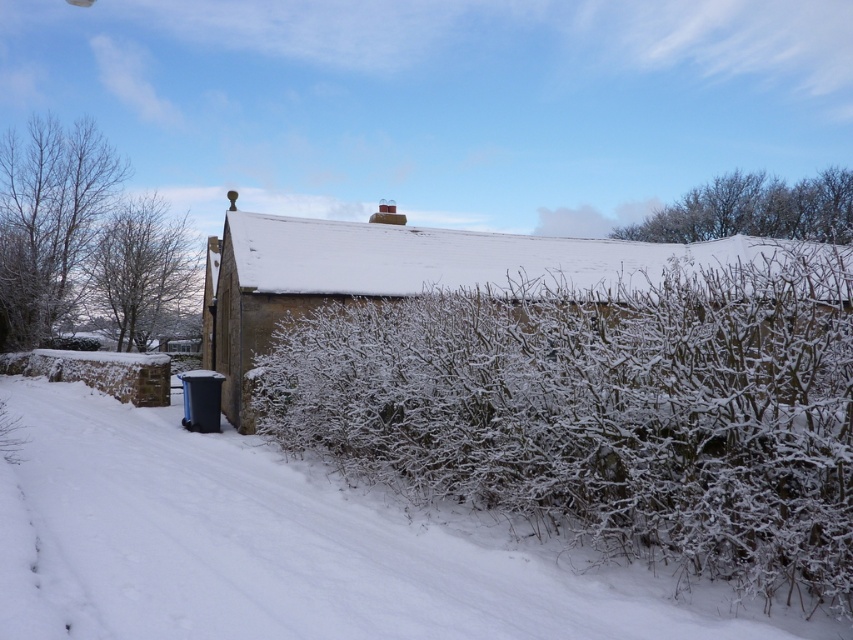
Question: Does white frosted hedge at center have a larger size compared to white frosty hedge at center?

Choices:
 (A) no
 (B) yes

Answer: (B)

Question: Is white frosted hedge at center thinner than white frosty hedge at center?

Choices:
 (A) no
 (B) yes

Answer: (A)

Question: Which point is closer to the camera taking this photo?

Choices:
 (A) (550, 608)
 (B) (822, 310)

Answer: (A)

Question: Is white frosted hedge at center in front of white frosty hedge at center?

Choices:
 (A) no
 (B) yes

Answer: (A)

Question: Which point is farther to the camera?

Choices:
 (A) (543, 461)
 (B) (459, 620)

Answer: (A)